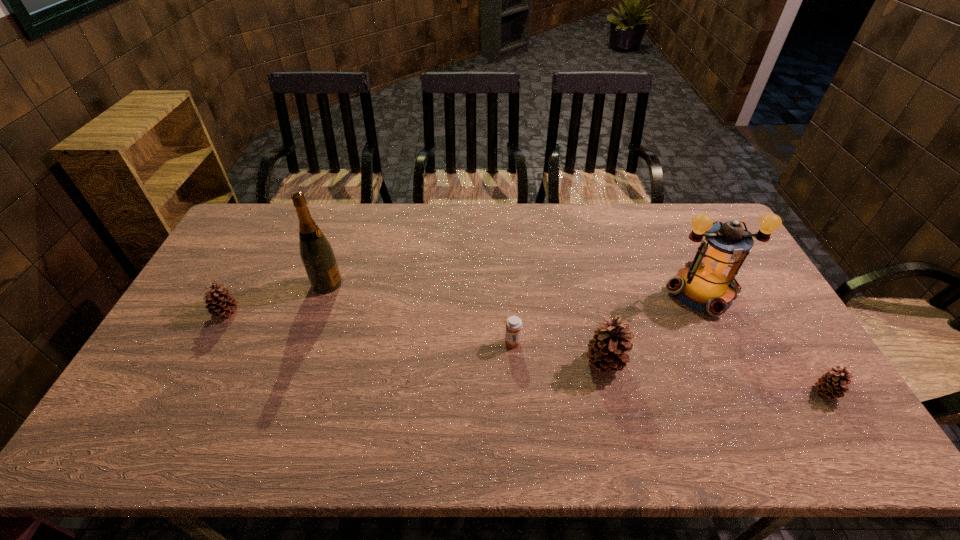
This screenshot has height=540, width=960. What are the coordinates of `free point that satisfies the following two spatial constraints: 1. on the front-facing side of the rightmost object; 2. on the right side of the wine bottle` in the screenshot? It's located at (290, 393).

What are the coordinates of `vacant space that satisfies the following two spatial constraints: 1. on the front-facing side of the wine bottle; 2. on the right side of the medicine` in the screenshot? It's located at 307,342.